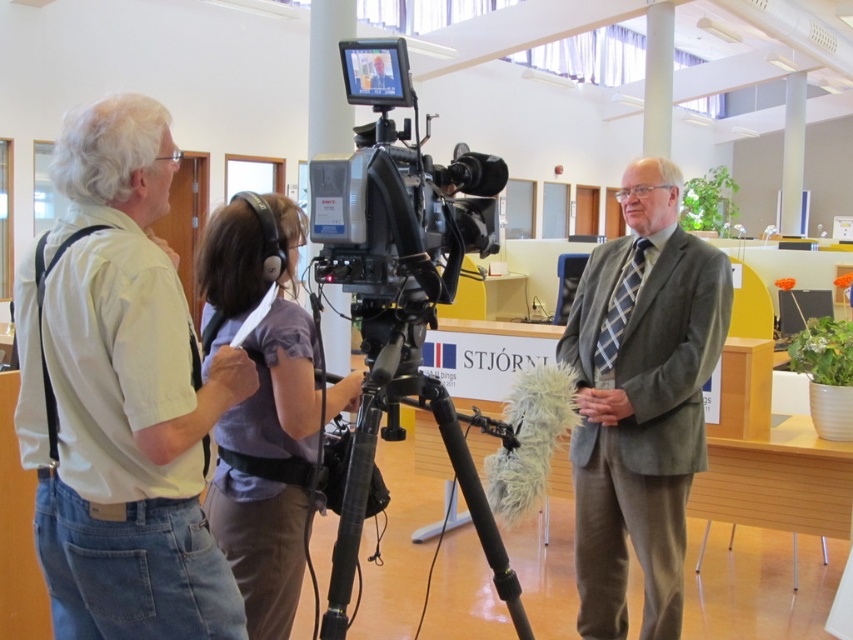
You are an event coordinator who needs to arrange seating for a panel discussion. The panelists are wearing a light beige shirt at left and a matte purple shirt at center. Based on their current positions, which panelist should be seated on the left side of the stage?

The light beige shirt at left should be seated on the left side of the stage since it is already positioned to the left of the matte purple shirt at center.